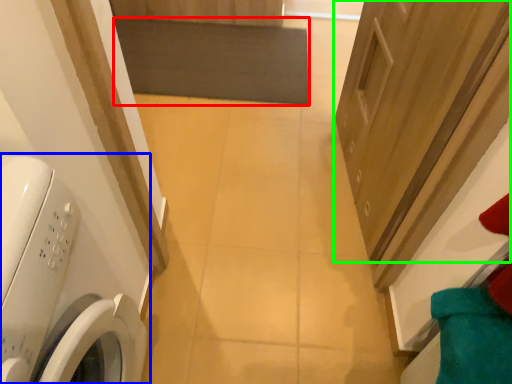
Question: Which object is positioned closest to mat (highlighted by a red box)? Select from washing machine (highlighted by a blue box) and door (highlighted by a green box).

Choices:
 (A) washing machine
 (B) door

Answer: (B)